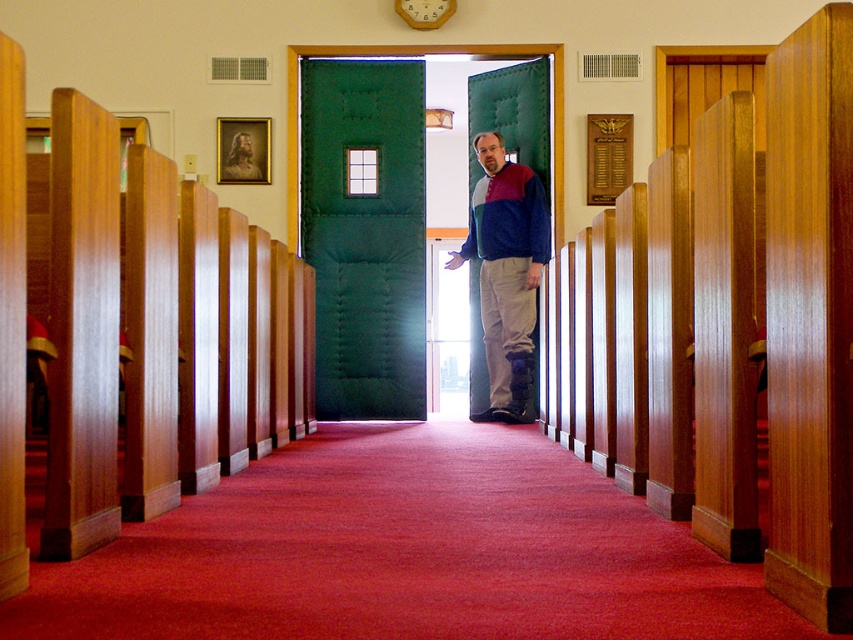
You are standing at the back of the church aisle and want to walk to the front. You notice two points marked in the image. Which point, point (250, 609) or point (505, 305), is closer to you?

Point (250, 609) is closer to you than point (505, 305).